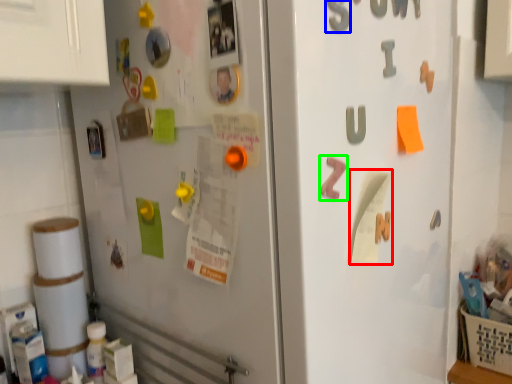
Question: Considering the real-world distances, which object is farthest from paper (highlighted by a red box)? number (highlighted by a blue box) or alphabet (highlighted by a green box)?

Choices:
 (A) number
 (B) alphabet

Answer: (A)